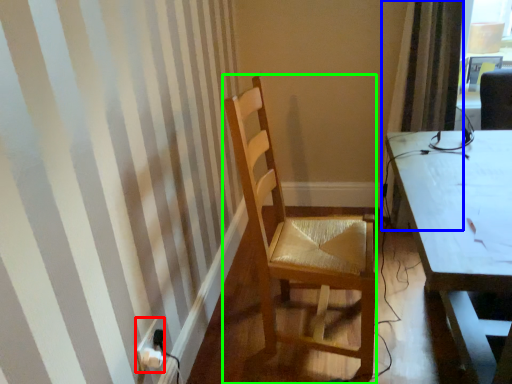
Question: Which object is the closest to the power plugs and sockets (highlighted by a red box)? Choose among these: curtain (highlighted by a blue box) or chair (highlighted by a green box).

Choices:
 (A) curtain
 (B) chair

Answer: (B)